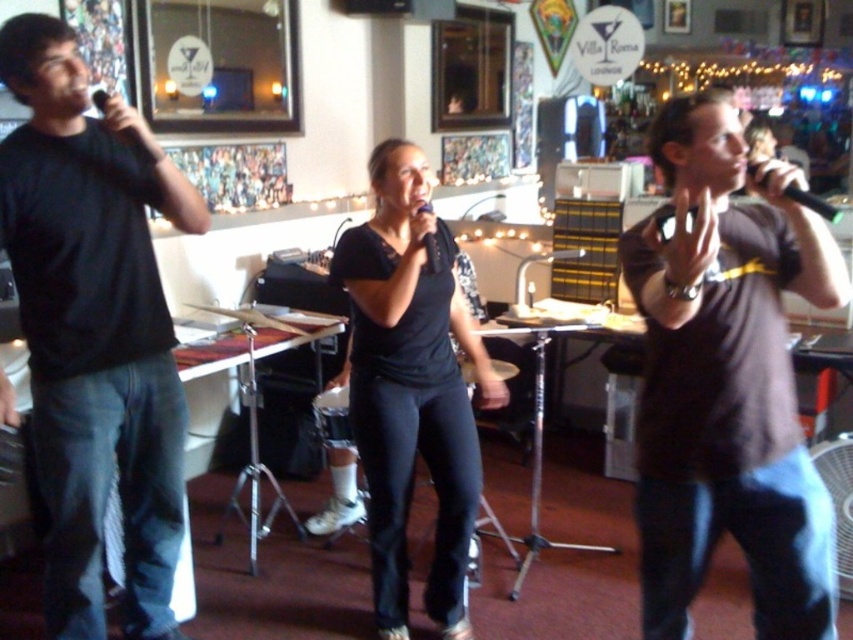
Question: Is black plastic microphone at upper right wider than black matte microphone at center?

Choices:
 (A) yes
 (B) no

Answer: (A)

Question: Which object is positioned closest to the black plastic microphone at upper right?

Choices:
 (A) black matte t-shirt at left
 (B) matte black shirt at center
 (C) black matte microphone at center
 (D) brown matte t-shirt at center

Answer: (B)

Question: Which of the following is the farthest from the observer?

Choices:
 (A) (102, 109)
 (B) (670, 289)
 (C) (821, 483)

Answer: (A)

Question: Does brown matte t-shirt at center have a smaller size compared to black matte t-shirt at left?

Choices:
 (A) no
 (B) yes

Answer: (A)

Question: Based on their relative distances, which object is farther from the brown matte t-shirt at center?

Choices:
 (A) black matte t-shirt at left
 (B) matte black microphone at upper left
 (C) matte black shirt at center

Answer: (B)

Question: Does brown matte t-shirt at center have a smaller size compared to black matte t-shirt at left?

Choices:
 (A) yes
 (B) no

Answer: (B)